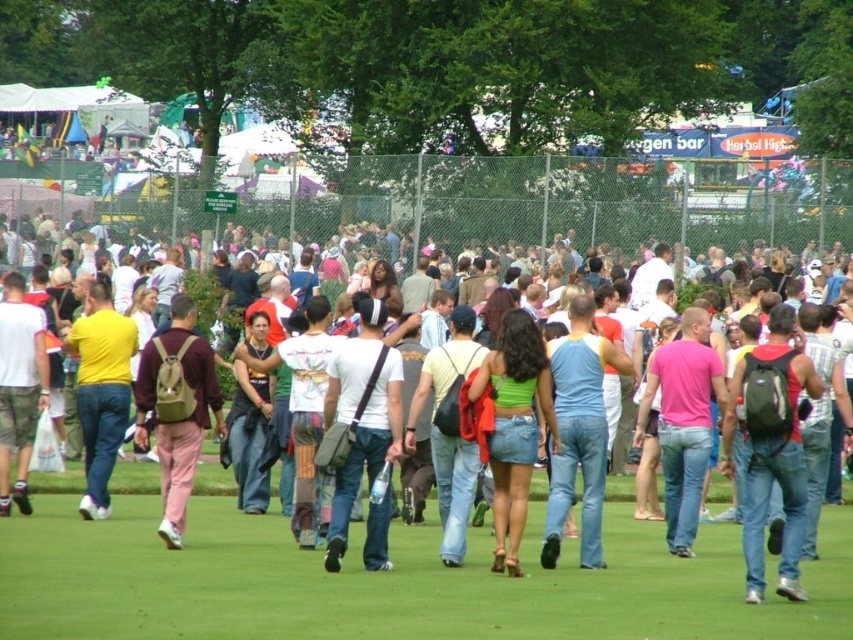
Question: Which object appears farthest from the camera in this image?

Choices:
 (A) pink fabric backpack at center
 (B) matte yellow shirt at center
 (C) matte black backpack at center-right
 (D) green grass at center

Answer: (B)

Question: Which point is farther to the camera?

Choices:
 (A) (502, 506)
 (B) (492, 636)
 (C) (784, 314)

Answer: (A)

Question: Can you confirm if matte black backpack at center-right is smaller than white cotton t-shirt at center?

Choices:
 (A) no
 (B) yes

Answer: (A)

Question: Where is green grass at center located in relation to blue denim jeans at center in the image?

Choices:
 (A) below
 (B) above

Answer: (A)

Question: Is matte black backpack at center-right bigger than matte yellow shirt at center?

Choices:
 (A) no
 (B) yes

Answer: (B)

Question: Estimate the real-world distances between objects in this image. Which object is closer to the khaki backpack at center?

Choices:
 (A) matte yellow shirt at center
 (B) matte black backpack at center-right
 (C) green grass at center
 (D) white cotton t-shirt at center

Answer: (A)